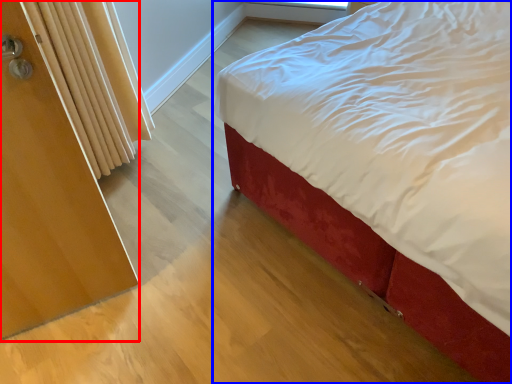
Question: Among these objects, which one is farthest to the camera, screen door (highlighted by a red box) or bed (highlighted by a blue box)?

Choices:
 (A) screen door
 (B) bed

Answer: (A)